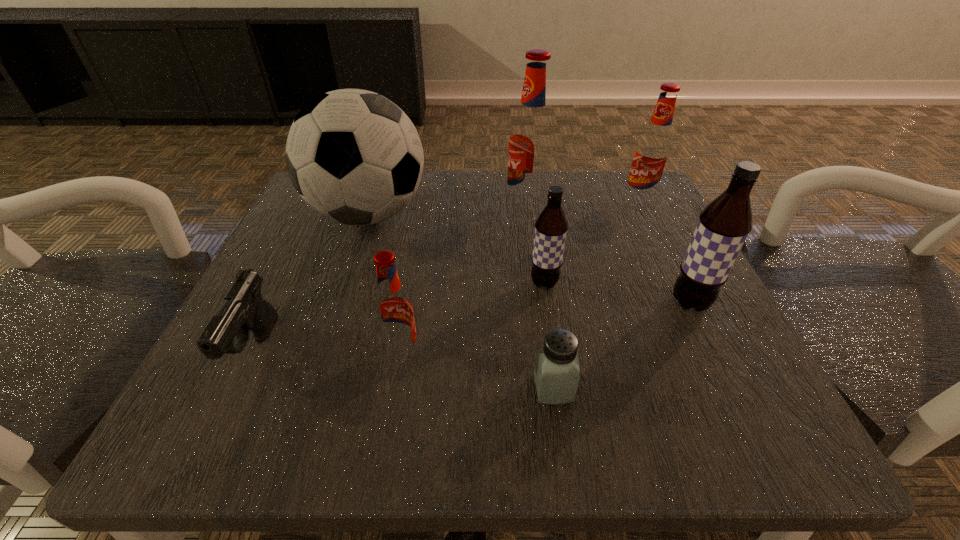
You are a GUI agent. You are given a task and a screenshot of the screen. Output one action in this format:
    pyautogui.click(x=<x>, y=<y>)
    Task: Click on the tallest root beer
    The height and width of the screenshot is (540, 960).
    Given the screenshot: What is the action you would take?
    pyautogui.click(x=531, y=140)

This screenshot has height=540, width=960. In order to click on the tallest object in this screenshot , I will do `click(531, 140)`.

This screenshot has height=540, width=960. Find the location of `black soccer ball`. black soccer ball is located at coordinates (354, 156).

Image resolution: width=960 pixels, height=540 pixels. Find the location of `the rightmost red root beer`. the rightmost red root beer is located at coordinates pos(652,153).

Where is `the right brown root beer`? The image size is (960, 540). the right brown root beer is located at coordinates (723, 226).

Identify the location of the smaller brown root beer. The image size is (960, 540). (551, 226).

You are a GUI agent. You are given a task and a screenshot of the screen. Output one action in this format:
    pyautogui.click(x=<x>, y=<y>)
    Task: Click on the nearest red root beer
    This screenshot has height=540, width=960.
    Given the screenshot: What is the action you would take?
    pyautogui.click(x=393, y=310)

This screenshot has width=960, height=540. What are the coordinates of `the smallest red root beer` in the screenshot? It's located at (393, 310).

Locate an element on the screen. black pistol is located at coordinates (244, 309).

This screenshot has width=960, height=540. Find the location of `saltshaker`. saltshaker is located at coordinates (556, 372).